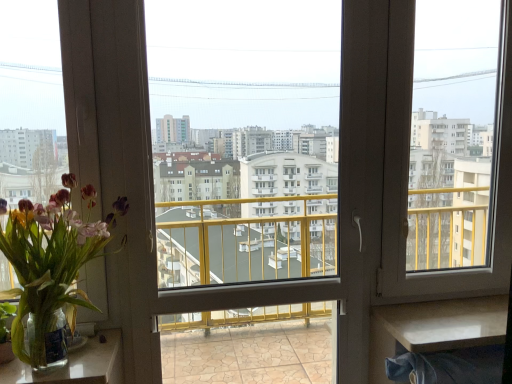
This screenshot has width=512, height=384. Describe the element at coordinates (244, 138) in the screenshot. I see `transparent plastic window screen at center, marked as the second window screen in a right-to-left arrangement` at that location.

Measure the distance between point (109,339) and camera.

1.31 meters.

I want to click on translucent glass vase at left, so click(x=51, y=269).

This screenshot has width=512, height=384. What do you see at coordinates (434, 328) in the screenshot?
I see `white glossy table at lower right, the second table viewed from the left` at bounding box center [434, 328].

Locate an element on the screen. The image size is (512, 384). transparent plastic window screen at center, marked as the second window screen in a right-to-left arrangement is located at coordinates (244, 138).

From the image's perspective, does translucent glass vase at left appear lower than white glossy table at lower right, marked as the 1th table in a right-to-left arrangement?

Incorrect, from the image's perspective, translucent glass vase at left is higher than white glossy table at lower right, marked as the 1th table in a right-to-left arrangement.

From a real-world perspective, does translucent glass vase at left stand above white glossy table at lower right, marked as the 1th table in a right-to-left arrangement?

Indeed, from a real-world perspective, translucent glass vase at left stands above white glossy table at lower right, marked as the 1th table in a right-to-left arrangement.

Does translucent glass vase at left have a lesser height compared to white glossy table at lower right, the second table viewed from the left?

No.

Visually, is transparent plastic window screen at center, marked as the second window screen in a right-to-left arrangement, positioned to the left or to the right of transparent glass window screen at right, marked as the 1th window screen in a right-to-left arrangement?

transparent plastic window screen at center, marked as the second window screen in a right-to-left arrangement, is positioned on transparent glass window screen at right, marked as the 1th window screen in a right-to-left arrangement,'s left side.

Which object is more forward, transparent plastic window screen at center, which is the first window screen in left-to-right order, or transparent glass window screen at right, marked as the 1th window screen in a right-to-left arrangement?

transparent plastic window screen at center, which is the first window screen in left-to-right order, is in front.

Considering the relative sizes of transparent plastic window screen at center, which is the first window screen in left-to-right order, and transparent glass window screen at right, the second window screen viewed from the left, in the image provided, is transparent plastic window screen at center, which is the first window screen in left-to-right order, smaller than transparent glass window screen at right, the second window screen viewed from the left,?

No.

Considering the sizes of transparent plastic window screen at center, marked as the second window screen in a right-to-left arrangement, and transparent glass window screen at right, the second window screen viewed from the left, in the image, is transparent plastic window screen at center, marked as the second window screen in a right-to-left arrangement, wider or thinner than transparent glass window screen at right, the second window screen viewed from the left,?

transparent plastic window screen at center, marked as the second window screen in a right-to-left arrangement, is wider than transparent glass window screen at right, the second window screen viewed from the left.

Can you confirm if clear glass vase at lower left, arranged as the first table when viewed from the left, is wider than transparent plastic window screen at center, which is the first window screen in left-to-right order?

Yes.

Which object is closer to the camera taking this photo, clear glass vase at lower left, arranged as the first table when viewed from the left, or transparent plastic window screen at center, which is the first window screen in left-to-right order?

clear glass vase at lower left, arranged as the first table when viewed from the left, is more forward.

Consider the image. Between clear glass vase at lower left, which is the second table from right to left, and transparent plastic window screen at center, which is the first window screen in left-to-right order, which one has larger size?

transparent plastic window screen at center, which is the first window screen in left-to-right order, is bigger.

Does clear glass vase at lower left, which is the second table from right to left, have a smaller size compared to white glossy table at lower right, marked as the 1th table in a right-to-left arrangement?

Correct, clear glass vase at lower left, which is the second table from right to left, occupies less space than white glossy table at lower right, marked as the 1th table in a right-to-left arrangement.

I want to click on table in front of the white glossy table at lower right, marked as the 1th table in a right-to-left arrangement, so click(76, 365).

From a real-world perspective, is clear glass vase at lower left, arranged as the first table when viewed from the left, below white glossy table at lower right, the second table viewed from the left?

Incorrect, from a real-world perspective, clear glass vase at lower left, arranged as the first table when viewed from the left, is higher than white glossy table at lower right, the second table viewed from the left.

From the image's perspective, which is below, clear glass vase at lower left, arranged as the first table when viewed from the left, or white glossy table at lower right, the second table viewed from the left?

clear glass vase at lower left, arranged as the first table when viewed from the left, is shown below in the image.

Is transparent glass window screen at right, marked as the 1th window screen in a right-to-left arrangement, taller than translucent glass vase at left?

Yes, transparent glass window screen at right, marked as the 1th window screen in a right-to-left arrangement, is taller than translucent glass vase at left.

Considering the relative sizes of transparent glass window screen at right, the second window screen viewed from the left, and translucent glass vase at left in the image provided, is transparent glass window screen at right, the second window screen viewed from the left, smaller than translucent glass vase at left?

Indeed, transparent glass window screen at right, the second window screen viewed from the left, has a smaller size compared to translucent glass vase at left.

Does point (425, 145) lie in front of point (62, 360)?

That is False.

Considering the relative sizes of transparent glass window screen at right, the second window screen viewed from the left, and translucent glass vase at left in the image provided, is transparent glass window screen at right, the second window screen viewed from the left, wider than translucent glass vase at left?

In fact, transparent glass window screen at right, the second window screen viewed from the left, might be narrower than translucent glass vase at left.

Is transparent glass window screen at right, the second window screen viewed from the left, positioned before clear glass vase at lower left, which is the second table from right to left?

No, transparent glass window screen at right, the second window screen viewed from the left, is behind clear glass vase at lower left, which is the second table from right to left.

Which of these two, transparent glass window screen at right, the second window screen viewed from the left, or clear glass vase at lower left, which is the second table from right to left, stands taller?

With more height is transparent glass window screen at right, the second window screen viewed from the left.

Does point (463, 201) lie behind point (100, 380)?

Yes.

From the image's perspective, is transparent glass window screen at right, marked as the 1th window screen in a right-to-left arrangement, located above clear glass vase at lower left, which is the second table from right to left?

Indeed, from the image's perspective, transparent glass window screen at right, marked as the 1th window screen in a right-to-left arrangement, is shown above clear glass vase at lower left, which is the second table from right to left.

Locate an element on the screen. Image resolution: width=512 pixels, height=384 pixels. the 2nd window screen positioned above the white glossy table at lower right, marked as the 1th table in a right-to-left arrangement (from a real-world perspective) is located at coordinates (453, 133).

Is transparent glass window screen at right, marked as the 1th window screen in a right-to-left arrangement, closer to camera compared to white glossy table at lower right, marked as the 1th table in a right-to-left arrangement?

No, transparent glass window screen at right, marked as the 1th window screen in a right-to-left arrangement, is behind white glossy table at lower right, marked as the 1th table in a right-to-left arrangement.

Which of these two, transparent glass window screen at right, marked as the 1th window screen in a right-to-left arrangement, or white glossy table at lower right, marked as the 1th table in a right-to-left arrangement, is smaller?

white glossy table at lower right, marked as the 1th table in a right-to-left arrangement.

The height and width of the screenshot is (384, 512). In order to click on houseplant that appears above the white glossy table at lower right, the second table viewed from the left (from the image's perspective) in this screenshot , I will do `click(51, 269)`.

This screenshot has width=512, height=384. I want to click on window screen in front of the transparent glass window screen at right, marked as the 1th window screen in a right-to-left arrangement, so click(244, 138).

When comparing their distances from white glossy table at lower right, marked as the 1th table in a right-to-left arrangement, does clear glass vase at lower left, which is the second table from right to left, or translucent glass vase at left seem closer?

The object closer to white glossy table at lower right, marked as the 1th table in a right-to-left arrangement, is clear glass vase at lower left, which is the second table from right to left.

Which object lies further to the anchor point transparent glass window screen at right, marked as the 1th window screen in a right-to-left arrangement, transparent plastic window screen at center, marked as the second window screen in a right-to-left arrangement, or clear glass vase at lower left, which is the second table from right to left?

transparent plastic window screen at center, marked as the second window screen in a right-to-left arrangement, lies further to transparent glass window screen at right, marked as the 1th window screen in a right-to-left arrangement, than the other object.

When comparing their distances from transparent plastic window screen at center, which is the first window screen in left-to-right order, does translucent glass vase at left or clear glass vase at lower left, which is the second table from right to left, seem further?

clear glass vase at lower left, which is the second table from right to left, lies further to transparent plastic window screen at center, which is the first window screen in left-to-right order, than the other object.

Which object lies further to the anchor point translucent glass vase at left, clear glass vase at lower left, which is the second table from right to left, or transparent plastic window screen at center, marked as the second window screen in a right-to-left arrangement?

Among the two, transparent plastic window screen at center, marked as the second window screen in a right-to-left arrangement, is located further to translucent glass vase at left.

When comparing their distances from transparent plastic window screen at center, marked as the second window screen in a right-to-left arrangement, does translucent glass vase at left or transparent glass window screen at right, marked as the 1th window screen in a right-to-left arrangement, seem further?

translucent glass vase at left is positioned further to the anchor transparent plastic window screen at center, marked as the second window screen in a right-to-left arrangement.

Based on their spatial positions, is white glossy table at lower right, marked as the 1th table in a right-to-left arrangement, or transparent plastic window screen at center, which is the first window screen in left-to-right order, closer to transparent glass window screen at right, the second window screen viewed from the left?

white glossy table at lower right, marked as the 1th table in a right-to-left arrangement, is closer to transparent glass window screen at right, the second window screen viewed from the left.

Looking at the image, which one is located closer to transparent glass window screen at right, the second window screen viewed from the left, white glossy table at lower right, the second table viewed from the left, or translucent glass vase at left?

The object closer to transparent glass window screen at right, the second window screen viewed from the left, is white glossy table at lower right, the second table viewed from the left.

Looking at this image, based on their spatial positions, is white glossy table at lower right, marked as the 1th table in a right-to-left arrangement, or transparent glass window screen at right, the second window screen viewed from the left, closer to transparent plastic window screen at center, which is the first window screen in left-to-right order?

transparent glass window screen at right, the second window screen viewed from the left, is closer to transparent plastic window screen at center, which is the first window screen in left-to-right order.

What are the coordinates of `window screen situated between transparent plastic window screen at center, which is the first window screen in left-to-right order, and white glossy table at lower right, the second table viewed from the left, from left to right` in the screenshot? It's located at (453, 133).

Locate an element on the screen. The width and height of the screenshot is (512, 384). window screen situated between translucent glass vase at left and transparent glass window screen at right, the second window screen viewed from the left, from left to right is located at coordinates (244, 138).

Identify the location of houseplant between clear glass vase at lower left, which is the second table from right to left, and transparent glass window screen at right, marked as the 1th window screen in a right-to-left arrangement, from left to right. Image resolution: width=512 pixels, height=384 pixels. (51, 269).

This screenshot has height=384, width=512. What are the coordinates of `houseplant located between clear glass vase at lower left, arranged as the first table when viewed from the left, and transparent plastic window screen at center, which is the first window screen in left-to-right order, in the left-right direction` in the screenshot? It's located at (51, 269).